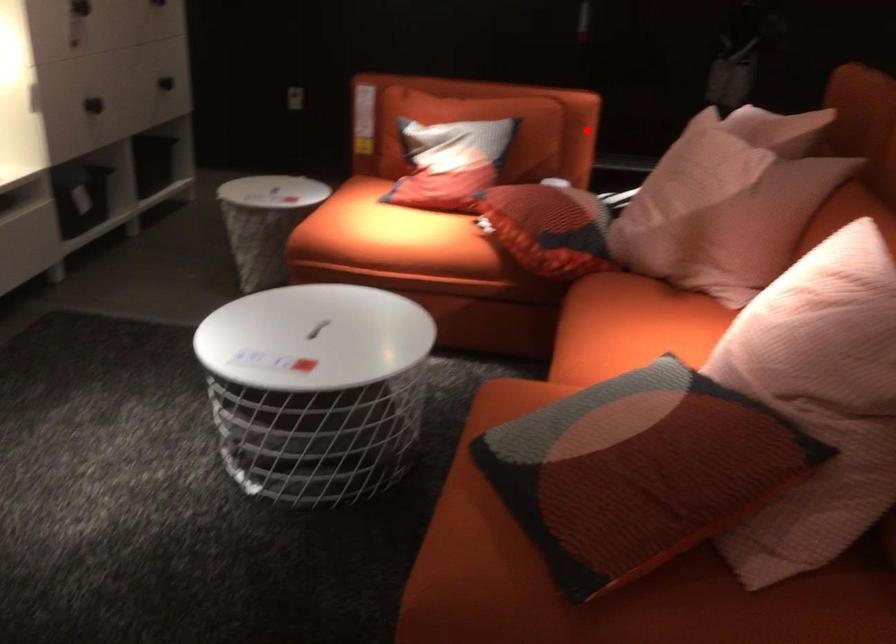
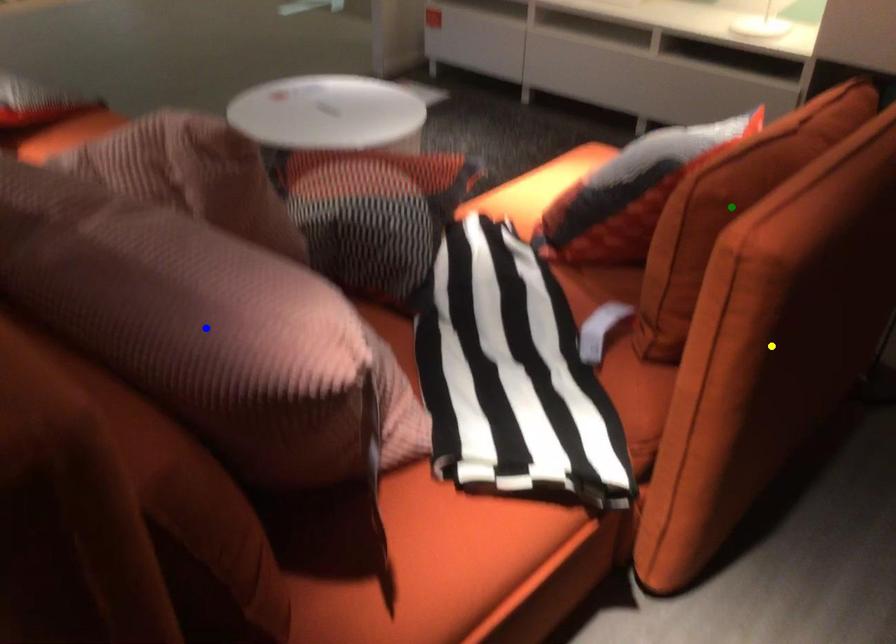
Question: I am providing you with two images of the same scene from different viewpoints. A red point is marked on the first image. You are given multiple points on the second image. Which spot in image 2 lines up with the point in image 1?

Choices:
 (A) yellow point
 (B) green point
 (C) blue point

Answer: (A)